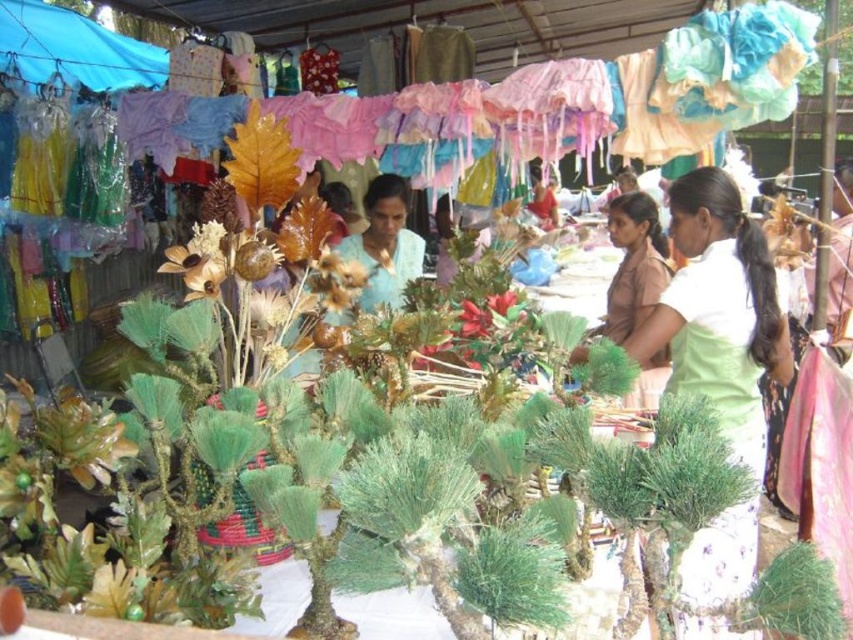
Which of these two, blue fabric canopy at upper left or green matte plant at center, stands shorter?

green matte plant at center is shorter.

Can you confirm if blue fabric canopy at upper left is wider than green matte plant at center?

Yes.

Measure the distance between point (90, 44) and camera.

A distance of 5.06 meters exists between point (90, 44) and camera.

At what (x,y) coordinates should I click in order to perform the action: click on blue fabric canopy at upper left. Please return your answer as a coordinate pair (x, y). The image size is (853, 640). Looking at the image, I should click on (73, 49).

Does point (64, 72) come closer to viewer compared to point (642, 275)?

That is False.

Locate an element on the screen. The image size is (853, 640). blue fabric canopy at upper left is located at coordinates (73, 49).

Between green satin blouse at right and brown matte dress at center, which one is positioned higher?

brown matte dress at center

Can you confirm if green satin blouse at right is taller than brown matte dress at center?

Correct, green satin blouse at right is much taller as brown matte dress at center.

Does point (759, 410) come farther from viewer compared to point (636, 314)?

No, it is not.

Locate an element on the screen. The height and width of the screenshot is (640, 853). green satin blouse at right is located at coordinates (718, 310).